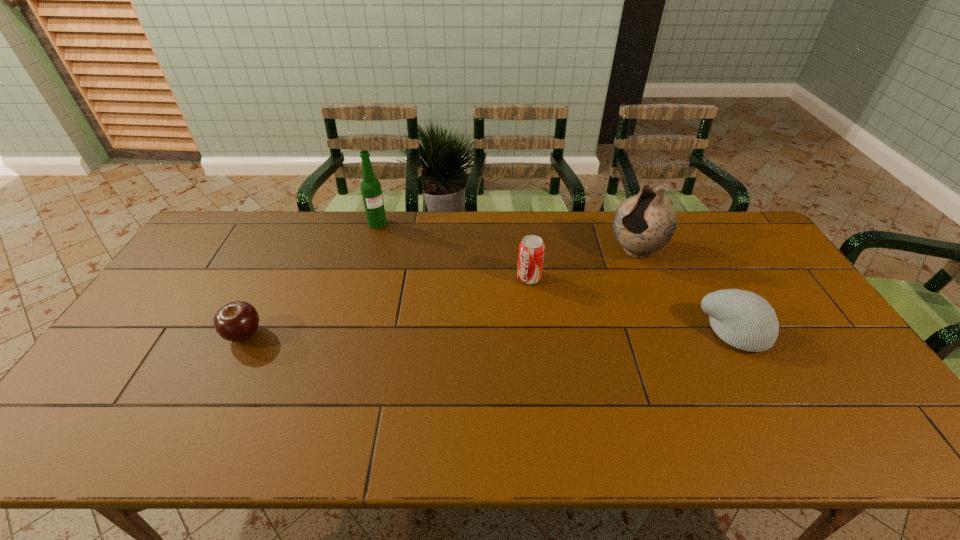
You are a GUI agent. You are given a task and a screenshot of the screen. Output one action in this format:
    pyautogui.click(x=<x>, y=<y>)
    Task: Click on the vacant space located from the spout of the pottery
    
    Given the screenshot: What is the action you would take?
    coord(603,276)

What are the coordinates of `free space located from the spout of the pottery` in the screenshot? It's located at (567, 302).

Identify the location of vacant area situated 0.050m on the logo side of the third object from left to right. This screenshot has width=960, height=540. (512, 293).

The image size is (960, 540). What are the coordinates of `blank area located 0.380m on the logo side of the third object from left to right` in the screenshot? It's located at (436, 362).

Where is `free spot located 0.270m on the logo side of the third object from left to right`? free spot located 0.270m on the logo side of the third object from left to right is located at coordinates (464, 337).

This screenshot has width=960, height=540. Find the location of `free space located on the label of the farthest object`. free space located on the label of the farthest object is located at coordinates (405, 264).

The height and width of the screenshot is (540, 960). In order to click on vacant region located on the label of the farthest object in this screenshot , I will do `click(424, 293)`.

This screenshot has height=540, width=960. I want to click on free space located on the label of the farthest object, so click(409, 269).

Identify the location of pottery present at the far edge. This screenshot has height=540, width=960. (644, 223).

Locate an element on the screen. Image resolution: width=960 pixels, height=540 pixels. beer bottle that is at the far edge is located at coordinates (371, 190).